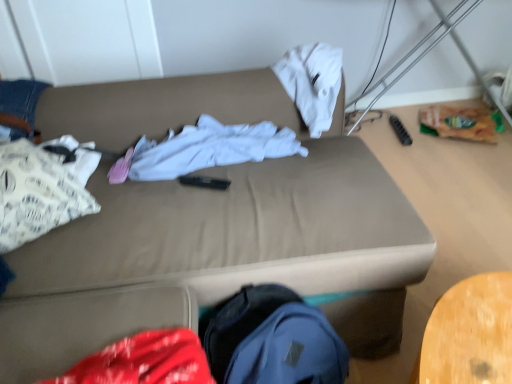
The height and width of the screenshot is (384, 512). Describe the element at coordinates (39, 192) in the screenshot. I see `white paper bag at left, which is the first clothing in left-to-right order` at that location.

The image size is (512, 384). What do you see at coordinates (210, 148) in the screenshot?
I see `white cotton shirt at center, which is the second clothing from left to right` at bounding box center [210, 148].

Where is `beige fabric couch at center`? Image resolution: width=512 pixels, height=384 pixels. beige fabric couch at center is located at coordinates (218, 254).

Find the location of a particular element. The image size is (512, 384). white paper bag at left, which is the first clothing in left-to-right order is located at coordinates (39, 192).

Consider the image. Can white cotton shirt at center, which appears as the first clothing when viewed from the right, be found inside white paper bag at left, which is the first clothing in left-to-right order?

Definitely not — white cotton shirt at center, which appears as the first clothing when viewed from the right, is not inside white paper bag at left, which is the first clothing in left-to-right order.

From a real-world perspective, between white paper bag at left, which is the first clothing in left-to-right order, and white cotton shirt at center, which is the second clothing from left to right, who is vertically lower?

white cotton shirt at center, which is the second clothing from left to right, from a real-world perspective.

Based on the photo, how distant is white paper bag at left, which is the first clothing in left-to-right order, from white cotton shirt at center, which appears as the first clothing when viewed from the right?

white paper bag at left, which is the first clothing in left-to-right order, is 14.14 inches away from white cotton shirt at center, which appears as the first clothing when viewed from the right.

Is beige fabric couch at center not inside white cotton shirt at center, which is the second clothing from left to right?

Yes, beige fabric couch at center is located beyond the bounds of white cotton shirt at center, which is the second clothing from left to right.

Considering the sizes of beige fabric couch at center and white cotton shirt at center, which is the second clothing from left to right, in the image, is beige fabric couch at center wider or thinner than white cotton shirt at center, which is the second clothing from left to right,?

In the image, beige fabric couch at center appears to be wider than white cotton shirt at center, which is the second clothing from left to right.

Considering the relative positions of beige fabric couch at center and white cotton shirt at center, which is the second clothing from left to right, in the image provided, is beige fabric couch at center in front of white cotton shirt at center, which is the second clothing from left to right,?

Yes, it is.

In terms of height, does white cotton shirt at center, which appears as the first clothing when viewed from the right, look taller or shorter compared to white paper bag at left, which is the first clothing in left-to-right order?

In the image, white cotton shirt at center, which appears as the first clothing when viewed from the right, appears to be shorter than white paper bag at left, which is the first clothing in left-to-right order.

In the scene shown: Considering the relative sizes of white cotton shirt at center, which appears as the first clothing when viewed from the right, and white paper bag at left, arranged as the 2th clothing when viewed from the right, in the image provided, is white cotton shirt at center, which appears as the first clothing when viewed from the right, thinner than white paper bag at left, arranged as the 2th clothing when viewed from the right,?

Yes, white cotton shirt at center, which appears as the first clothing when viewed from the right, is thinner than white paper bag at left, arranged as the 2th clothing when viewed from the right.

Is white cotton shirt at center, which is the second clothing from left to right, spatially inside white paper bag at left, arranged as the 2th clothing when viewed from the right, or outside of it?

white cotton shirt at center, which is the second clothing from left to right, cannot be found inside white paper bag at left, arranged as the 2th clothing when viewed from the right.

Is white cotton shirt at center, which is the second clothing from left to right, bigger than white paper bag at left, which is the first clothing in left-to-right order?

Indeed, white cotton shirt at center, which is the second clothing from left to right, has a larger size compared to white paper bag at left, which is the first clothing in left-to-right order.

Is the surface of white paper bag at left, which is the first clothing in left-to-right order, in direct contact with beige fabric couch at center?

No, white paper bag at left, which is the first clothing in left-to-right order, is not next to beige fabric couch at center.

Considering the sizes of objects white paper bag at left, arranged as the 2th clothing when viewed from the right, and beige fabric couch at center in the image provided, who is wider, white paper bag at left, arranged as the 2th clothing when viewed from the right, or beige fabric couch at center?

beige fabric couch at center.

Is white paper bag at left, arranged as the 2th clothing when viewed from the right, facing towards beige fabric couch at center?

Yes, white paper bag at left, arranged as the 2th clothing when viewed from the right, faces towards beige fabric couch at center.

Which of these two, white paper bag at left, arranged as the 2th clothing when viewed from the right, or beige fabric couch at center, is bigger?

Bigger between the two is beige fabric couch at center.

Locate an element on the screen. The width and height of the screenshot is (512, 384). clothing that is the 2nd object located behind the beige fabric couch at center is located at coordinates (210, 148).

Is point (193, 153) in front of point (280, 179)?

No, it is behind (280, 179).

In the scene shown: Can you confirm if beige fabric couch at center is thinner than white paper bag at left, arranged as the 2th clothing when viewed from the right?

No.

From a real-world perspective, is beige fabric couch at center beneath white paper bag at left, arranged as the 2th clothing when viewed from the right?

Yes.

Would you say beige fabric couch at center is a long distance from white paper bag at left, which is the first clothing in left-to-right order?

Actually, beige fabric couch at center and white paper bag at left, which is the first clothing in left-to-right order, are a little close together.

Could you tell me if beige fabric couch at center is turned towards white paper bag at left, arranged as the 2th clothing when viewed from the right?

Yes, beige fabric couch at center is facing white paper bag at left, arranged as the 2th clothing when viewed from the right.

The image size is (512, 384). In order to click on clothing in front of the white cotton shirt at center, which appears as the first clothing when viewed from the right in this screenshot , I will do `click(39, 192)`.

The image size is (512, 384). What are the coordinates of `clothing that is the 1st object above the beige fabric couch at center (from a real-world perspective)` in the screenshot? It's located at (210, 148).

Looking at the image, which one is located closer to white cotton shirt at center, which appears as the first clothing when viewed from the right, beige fabric couch at center or white paper bag at left, which is the first clothing in left-to-right order?

The object closer to white cotton shirt at center, which appears as the first clothing when viewed from the right, is beige fabric couch at center.

Looking at the image, which one is located further to beige fabric couch at center, white paper bag at left, which is the first clothing in left-to-right order, or white cotton shirt at center, which appears as the first clothing when viewed from the right?

The object further to beige fabric couch at center is white paper bag at left, which is the first clothing in left-to-right order.

From the image, which object appears to be farther from white cotton shirt at center, which appears as the first clothing when viewed from the right, white paper bag at left, arranged as the 2th clothing when viewed from the right, or beige fabric couch at center?

The object further to white cotton shirt at center, which appears as the first clothing when viewed from the right, is white paper bag at left, arranged as the 2th clothing when viewed from the right.

Considering their positions, is white cotton shirt at center, which is the second clothing from left to right, positioned further to white paper bag at left, arranged as the 2th clothing when viewed from the right, than beige fabric couch at center?

white cotton shirt at center, which is the second clothing from left to right, is positioned further to the anchor white paper bag at left, arranged as the 2th clothing when viewed from the right.

Consider the image. From the image, which object appears to be farther from white paper bag at left, arranged as the 2th clothing when viewed from the right, beige fabric couch at center or white cotton shirt at center, which is the second clothing from left to right?

Among the two, white cotton shirt at center, which is the second clothing from left to right, is located further to white paper bag at left, arranged as the 2th clothing when viewed from the right.

From the image, which object appears to be nearer to beige fabric couch at center, white cotton shirt at center, which appears as the first clothing when viewed from the right, or white paper bag at left, which is the first clothing in left-to-right order?

The object closer to beige fabric couch at center is white cotton shirt at center, which appears as the first clothing when viewed from the right.

Find the location of a particular element. Image resolution: width=512 pixels, height=384 pixels. studio couch between white paper bag at left, which is the first clothing in left-to-right order, and white cotton shirt at center, which appears as the first clothing when viewed from the right is located at coordinates point(218,254).